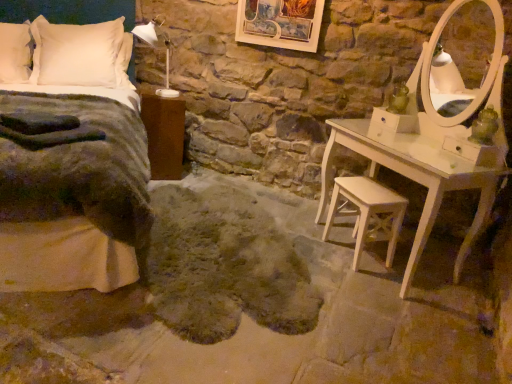
The image size is (512, 384). I want to click on vacant space situated on the left part of white wood stool at lower right, so click(x=318, y=251).